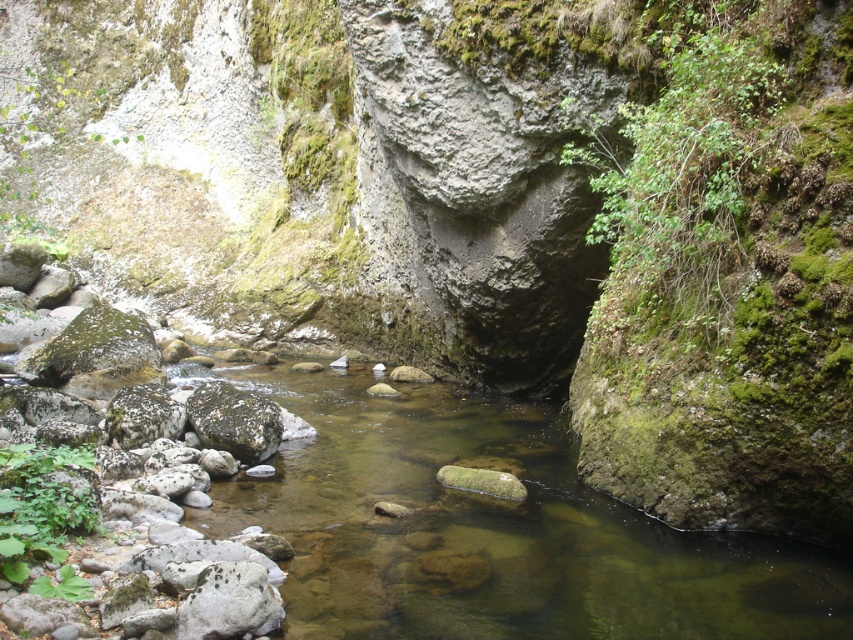
Can you confirm if clear water stream at center is wider than green mossy rock at center?

Yes.

Can you confirm if clear water stream at center is positioned above green mossy rock at center?

Actually, clear water stream at center is below green mossy rock at center.

The height and width of the screenshot is (640, 853). What do you see at coordinates (492, 529) in the screenshot?
I see `clear water stream at center` at bounding box center [492, 529].

I want to click on clear water stream at center, so click(492, 529).